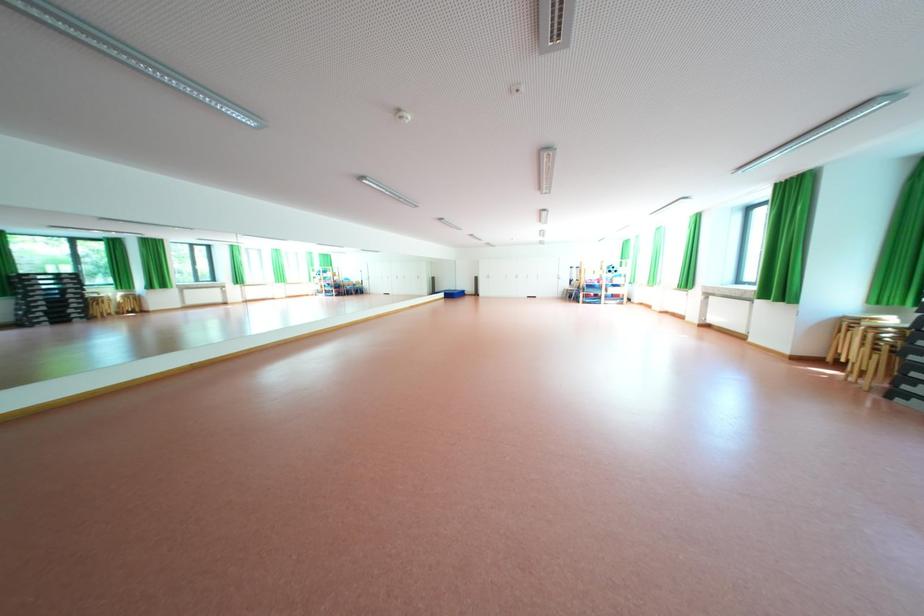
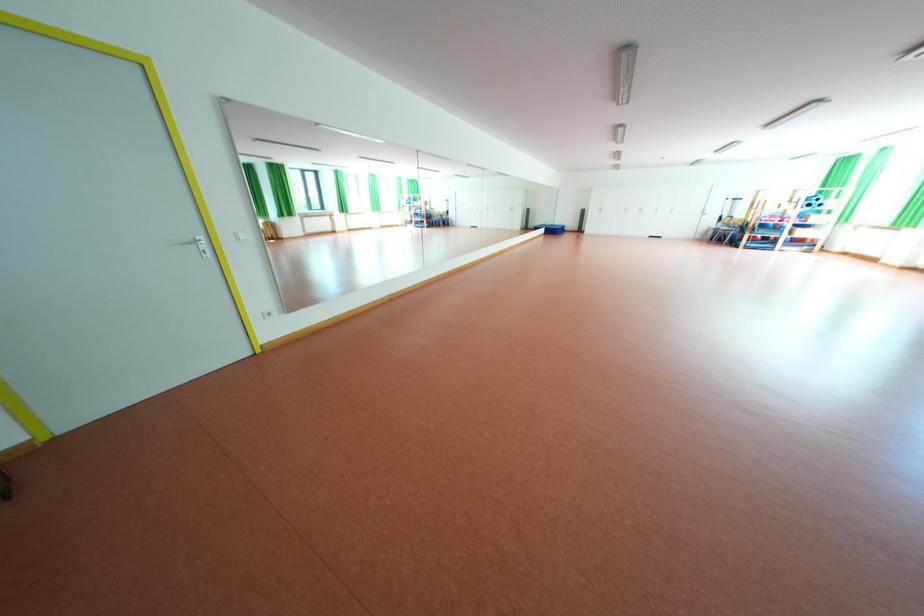
Question: The images are taken continuously from a first-person perspective. In which direction are you moving?

Choices:
 (A) Left
 (B) Right
 (C) Forward
 (D) Backward

Answer: (A)